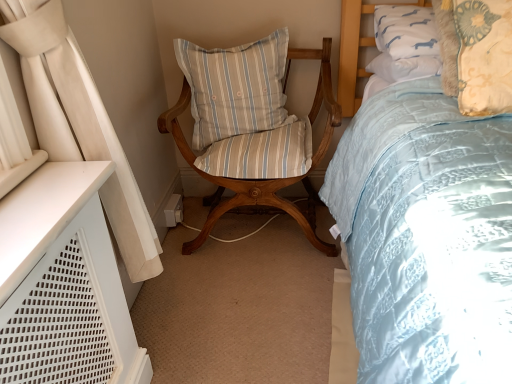
Question: Considering the positions of point (232, 112) and point (246, 46), is point (232, 112) closer or farther from the camera than point (246, 46)?

Choices:
 (A) farther
 (B) closer

Answer: (B)

Question: Is light blue striped cushion at center, the first pillow positioned from the left, taller or shorter than wooden chair with striped cushion at center?

Choices:
 (A) short
 (B) tall

Answer: (A)

Question: Which object is the closest to the light blue striped cushion at center, the first pillow positioned from the left?

Choices:
 (A) wooden chair with striped cushion at center
 (B) floral-patterned fabric pillow at upper right, which appears as the 2th pillow when viewed from the back

Answer: (A)

Question: Which of these objects is positioned closest to the floral-patterned fabric pillow at upper right, arranged as the 1th pillow when viewed from the right?

Choices:
 (A) light blue striped cushion at center, the first pillow positioned from the left
 (B) wooden chair with striped cushion at center

Answer: (B)